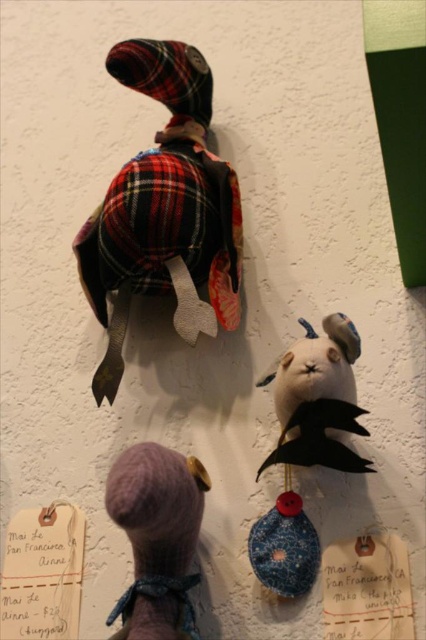
Which stuffed animal is the point at coordinates (164, 211) located on?

The point at coordinates (164, 211) is located on the plaid fabric duck at upper left.

You are standing in front of the handmade stuffed animals displayed against the textured white wall. You see the plaid fabric duck at upper left. Can you reach it with your outstretched hand if you are an average adult with an arm length of 0.7 meters?

The plaid fabric duck at upper left is 1.02 meters away from the viewer. Since the average adult arm length is 0.7 meters, you cannot reach it with your outstretched hand.

You are a child trying to reach both the plaid fabric duck at upper left and the fuzzy pink doll at lower left on a wall shelf. Which toy can you grab first without moving your position?

The plaid fabric duck at upper left is closer to you than the fuzzy pink doll at lower left, so you can grab it first without moving.